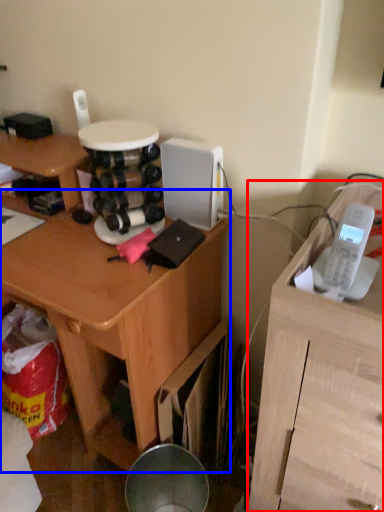
Question: Which object appears closest to the camera in this image, furniture (highlighted by a red box) or desk (highlighted by a blue box)?

Choices:
 (A) furniture
 (B) desk

Answer: (A)